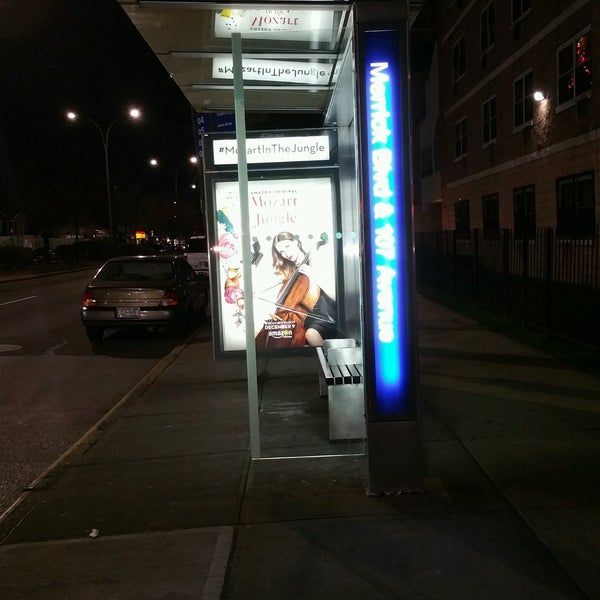
Where is `poster`? The image size is (600, 600). poster is located at coordinates pos(268,279).